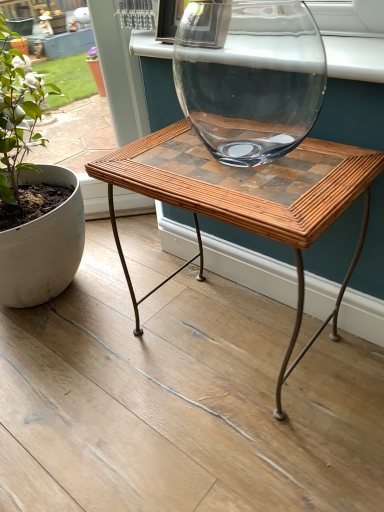
Question: Can you confirm if green matte plant at left is thinner than woven wood table at center?

Choices:
 (A) no
 (B) yes

Answer: (A)

Question: Is woven wood table at center completely or partially inside green matte plant at left?

Choices:
 (A) yes
 (B) no

Answer: (B)

Question: Does green matte plant at left appear on the right side of woven wood table at center?

Choices:
 (A) yes
 (B) no

Answer: (B)

Question: Is green matte plant at left directly adjacent to woven wood table at center?

Choices:
 (A) yes
 (B) no

Answer: (B)

Question: Is green matte plant at left taller than woven wood table at center?

Choices:
 (A) no
 (B) yes

Answer: (B)

Question: Choose the correct answer: Is clear glass vase at upper center inside woven wood table at center or outside it?

Choices:
 (A) outside
 (B) inside

Answer: (A)

Question: From the image's perspective, relative to woven wood table at center, is clear glass vase at upper center above or below?

Choices:
 (A) below
 (B) above

Answer: (B)

Question: In terms of width, does clear glass vase at upper center look wider or thinner when compared to woven wood table at center?

Choices:
 (A) wide
 (B) thin

Answer: (B)

Question: Is clear glass vase at upper center to the left or to the right of woven wood table at center in the image?

Choices:
 (A) left
 (B) right

Answer: (A)

Question: Is clear glass vase at upper center in front of or behind green matte plant at left in the image?

Choices:
 (A) behind
 (B) front

Answer: (A)

Question: In terms of size, does clear glass vase at upper center appear bigger or smaller than green matte plant at left?

Choices:
 (A) big
 (B) small

Answer: (B)

Question: From a real-world perspective, relative to green matte plant at left, is clear glass vase at upper center vertically above or below?

Choices:
 (A) below
 (B) above

Answer: (B)

Question: From the image's perspective, relative to green matte plant at left, is clear glass vase at upper center above or below?

Choices:
 (A) below
 (B) above

Answer: (B)

Question: From a real-world perspective, is green matte plant at left physically located above or below woven wood table at center?

Choices:
 (A) above
 (B) below

Answer: (A)

Question: Looking at their shapes, would you say green matte plant at left is wider or thinner than woven wood table at center?

Choices:
 (A) wide
 (B) thin

Answer: (A)